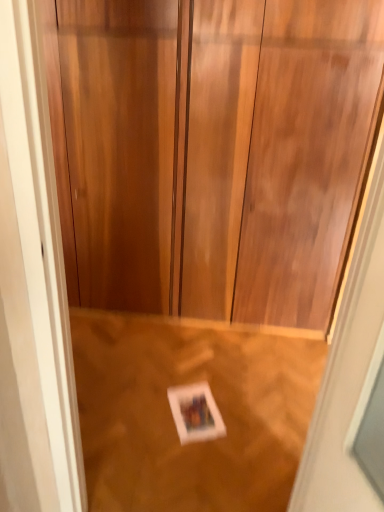
You are a GUI agent. You are given a task and a screenshot of the screen. Output one action in this format:
    pyautogui.click(x=<x>, y=<y>)
    Task: Click on the free location above wooden floor at lower center (from a real-world perspective)
    This screenshot has width=384, height=512.
    Given the screenshot: What is the action you would take?
    pyautogui.click(x=156, y=382)